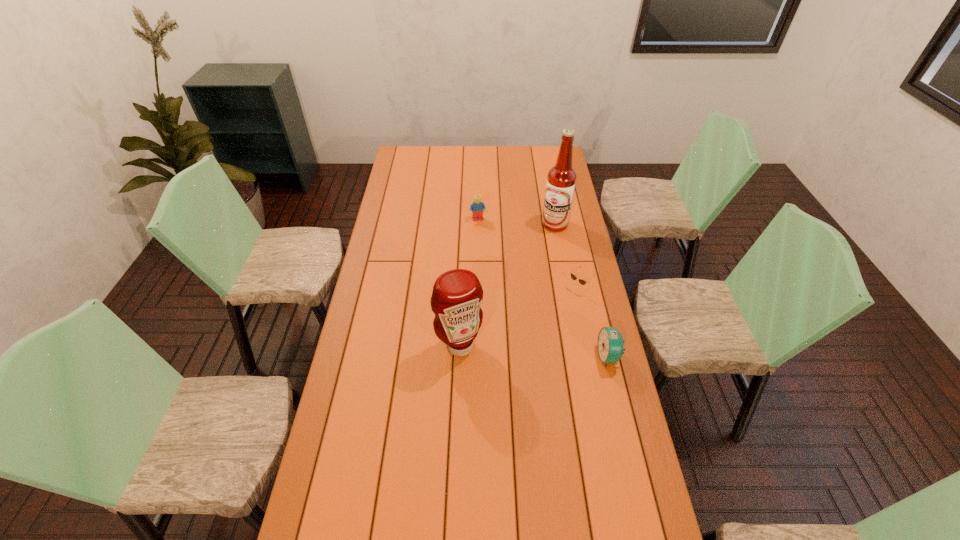
Where is `free point between the third nearest object and the alarm clock`? This screenshot has height=540, width=960. free point between the third nearest object and the alarm clock is located at coordinates (592, 322).

Image resolution: width=960 pixels, height=540 pixels. I want to click on vacant area that lies between the alarm clock and the Lego, so click(543, 288).

I want to click on free space that is in between the condiment and the sunglasses, so click(517, 318).

Find the location of `vacant area between the shortest object and the Lego`. vacant area between the shortest object and the Lego is located at coordinates (527, 254).

I want to click on empty space between the condiment and the sunglasses, so click(x=517, y=318).

You are a GUI agent. You are given a task and a screenshot of the screen. Output one action in this format:
    pyautogui.click(x=<x>, y=<y>)
    Task: Click on the vacant area between the second tallest object and the alarm clock
    The height and width of the screenshot is (540, 960).
    Given the screenshot: What is the action you would take?
    pyautogui.click(x=534, y=351)

Identify the location of object that is the second closest one to the second tallest object. The width and height of the screenshot is (960, 540). (610, 344).

Point out which object is positioned as the second nearest to the third farthest object. Please provide its 2D coordinates. Your answer should be formatted as a tuple, i.e. [(x, y)], where the tuple contains the x and y coordinates of a point satisfying the conditions above.

[(561, 180)]

At what (x,y) coordinates should I click in order to perform the action: click on free space that satisfies the following two spatial constraints: 1. on the front side of the Lego; 2. on the right side of the third farthest object. Please return your answer as a coordinate pair (x, y). The height and width of the screenshot is (540, 960). Looking at the image, I should click on click(x=478, y=289).

Where is `vacant space that satisfies the following two spatial constraints: 1. on the back side of the Lego; 2. on the left side of the fourth shortest object`? The height and width of the screenshot is (540, 960). vacant space that satisfies the following two spatial constraints: 1. on the back side of the Lego; 2. on the left side of the fourth shortest object is located at coordinates (465, 220).